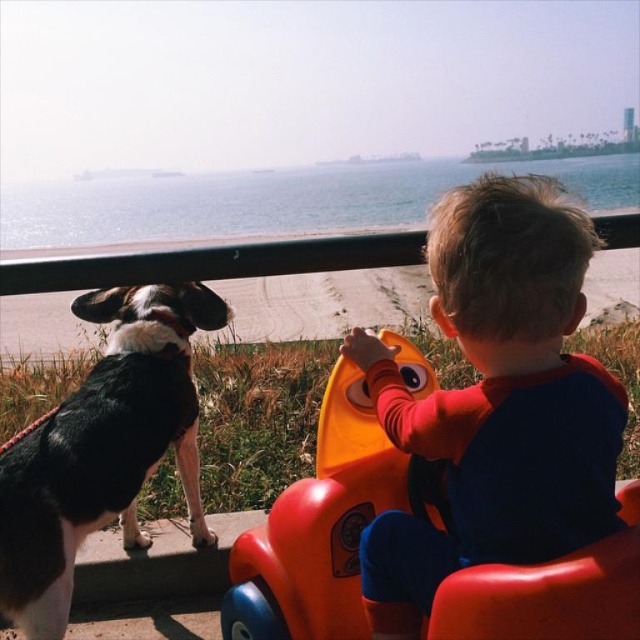
Can you confirm if orange plastic toy car at center is shorter than black and white fur dog at left?

Yes, orange plastic toy car at center is shorter than black and white fur dog at left.

The height and width of the screenshot is (640, 640). In order to click on orange plastic toy car at center in this screenshot , I will do `click(323, 525)`.

Who is higher up, smooth orange plastic toy car at center or orange plastic toy car at center?

smooth orange plastic toy car at center

Does smooth orange plastic toy car at center appear on the left side of orange plastic toy car at center?

No, smooth orange plastic toy car at center is not to the left of orange plastic toy car at center.

Describe the element at coordinates (497, 401) in the screenshot. This screenshot has height=640, width=640. I see `smooth orange plastic toy car at center` at that location.

Where is `smooth orange plastic toy car at center`? The height and width of the screenshot is (640, 640). smooth orange plastic toy car at center is located at coordinates (497, 401).

This screenshot has width=640, height=640. What do you see at coordinates (497, 401) in the screenshot?
I see `smooth orange plastic toy car at center` at bounding box center [497, 401].

Is smooth orange plastic toy car at center taller than black and white fur dog at left?

No, smooth orange plastic toy car at center is not taller than black and white fur dog at left.

Is point (528, 435) positioned after point (49, 595)?

That is False.

Where is `smooth orange plastic toy car at center`? This screenshot has height=640, width=640. smooth orange plastic toy car at center is located at coordinates (497, 401).